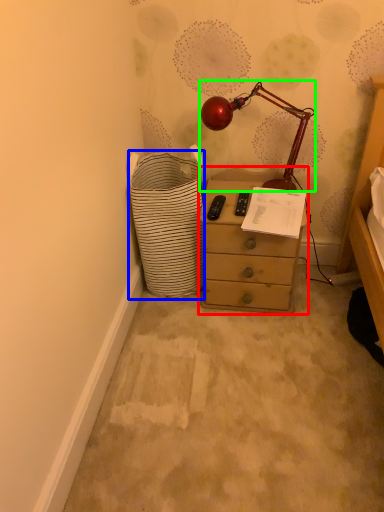
Question: Estimate the real-world distances between objects in this image. Which object is farther from chest of drawers (highlighted by a red box), shopping basket (highlighted by a blue box) or lamp (highlighted by a green box)?

Choices:
 (A) shopping basket
 (B) lamp

Answer: (B)